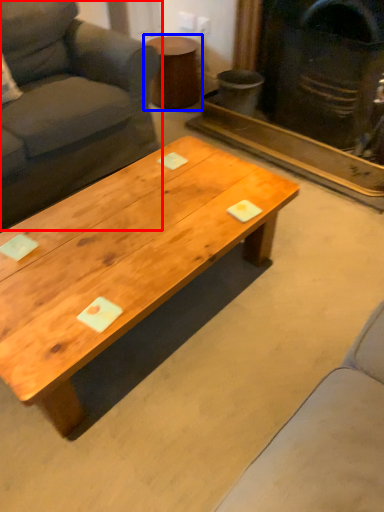
Question: Among these objects, which one is nearest to the camera, studio couch (highlighted by a red box) or side table (highlighted by a blue box)?

Choices:
 (A) studio couch
 (B) side table

Answer: (A)